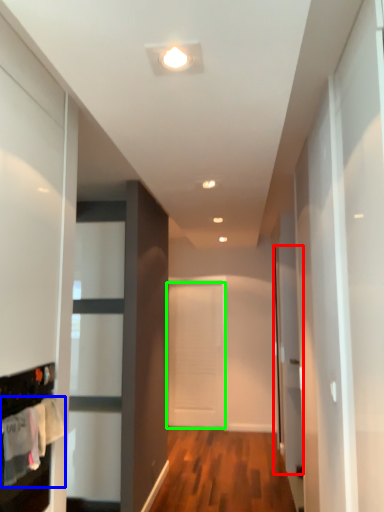
Question: Which object is positioned closest to glass door (highlighted by a red box)? Select from laundry (highlighted by a blue box) and door (highlighted by a green box).

Choices:
 (A) laundry
 (B) door

Answer: (B)